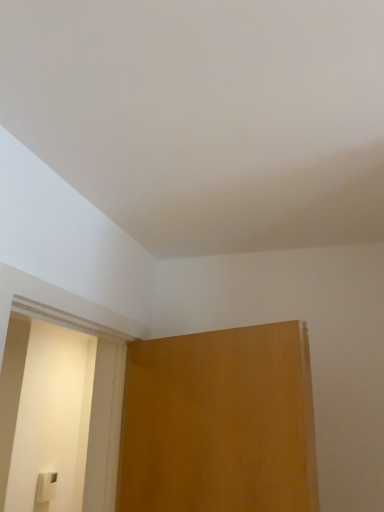
What is the approximate height of white plastic light switch at lower left?

white plastic light switch at lower left is 11.85 inches in height.

Describe the element at coordinates (46, 487) in the screenshot. I see `white plastic light switch at lower left` at that location.

In order to face white plastic light switch at lower left, should I rotate leftwards or rightwards?

Turn left by 19.217 degrees to look at white plastic light switch at lower left.

You are a GUI agent. You are given a task and a screenshot of the screen. Output one action in this format:
    pyautogui.click(x=<x>, y=<y>)
    Task: Click on the white plastic light switch at lower left
    Image resolution: width=384 pixels, height=512 pixels.
    Given the screenshot: What is the action you would take?
    pyautogui.click(x=46, y=487)

Describe the element at coordinates (43, 413) in the screenshot. I see `matte wood screen door at left` at that location.

At what (x,y) coordinates should I click in order to perform the action: click on matte wood screen door at left. Please return your answer as a coordinate pair (x, y). The width and height of the screenshot is (384, 512). Looking at the image, I should click on (43, 413).

Locate an element on the screen. The height and width of the screenshot is (512, 384). white plastic light switch at lower left is located at coordinates (46, 487).

Does white plastic light switch at lower left appear on the left side of matte wood screen door at left?

Indeed, white plastic light switch at lower left is positioned on the left side of matte wood screen door at left.

Which object is more forward, white plastic light switch at lower left or matte wood screen door at left?

matte wood screen door at left is closer to the camera.

Considering the points (54, 475) and (38, 449), which point is behind, point (54, 475) or point (38, 449)?

Point (54, 475)

From the image's perspective, is white plastic light switch at lower left above matte wood screen door at left?

No, from the image's perspective, white plastic light switch at lower left is not over matte wood screen door at left.

From a real-world perspective, between white plastic light switch at lower left and matte wood screen door at left, who is vertically higher?

From a 3D spatial view, matte wood screen door at left is above.

Which object is thinner, white plastic light switch at lower left or matte wood screen door at left?

white plastic light switch at lower left.

In terms of height, does white plastic light switch at lower left look taller or shorter compared to matte wood screen door at left?

white plastic light switch at lower left is shorter than matte wood screen door at left.

Who is smaller, white plastic light switch at lower left or matte wood screen door at left?

Smaller between the two is white plastic light switch at lower left.

Would you say white plastic light switch at lower left is outside matte wood screen door at left?

white plastic light switch at lower left lies outside matte wood screen door at left's area.

Are white plastic light switch at lower left and matte wood screen door at left far apart?

They are positioned close to each other.

Is white plastic light switch at lower left facing away from matte wood screen door at left?

That's not correct — white plastic light switch at lower left is not looking away from matte wood screen door at left.

How different are the orientations of white plastic light switch at lower left and matte wood screen door at left in degrees?

0.509 degrees.

At what (x,y) coordinates should I click in order to perform the action: click on light switch below the matte wood screen door at left (from a real-world perspective). Please return your answer as a coordinate pair (x, y). Looking at the image, I should click on (46, 487).

Can you confirm if matte wood screen door at left is positioned to the right of white plastic light switch at lower left?

Indeed, matte wood screen door at left is positioned on the right side of white plastic light switch at lower left.

Considering the positions of objects matte wood screen door at left and white plastic light switch at lower left in the image provided, who is in front, matte wood screen door at left or white plastic light switch at lower left?

matte wood screen door at left is more forward.

Does point (14, 336) come in front of point (53, 479)?

Yes, it is.

From the image's perspective, would you say matte wood screen door at left is positioned over white plastic light switch at lower left?

Yes, from the image's perspective, matte wood screen door at left is above white plastic light switch at lower left.

From a real-world perspective, between matte wood screen door at left and white plastic light switch at lower left, who is vertically higher?

In real-world perspective, matte wood screen door at left is above.

Does matte wood screen door at left have a greater width compared to white plastic light switch at lower left?

Yes, matte wood screen door at left is wider than white plastic light switch at lower left.

Does matte wood screen door at left have a greater height compared to white plastic light switch at lower left?

Indeed, matte wood screen door at left has a greater height compared to white plastic light switch at lower left.

Consider the image. Does matte wood screen door at left have a larger size compared to white plastic light switch at lower left?

Indeed, matte wood screen door at left has a larger size compared to white plastic light switch at lower left.

Would you say matte wood screen door at left contains white plastic light switch at lower left?

That's incorrect, white plastic light switch at lower left is not inside matte wood screen door at left.

Is matte wood screen door at left positioned far away from white plastic light switch at lower left?

No.

Is matte wood screen door at left turned away from white plastic light switch at lower left?

That's not correct — matte wood screen door at left is not looking away from white plastic light switch at lower left.

How many degrees apart are the facing directions of matte wood screen door at left and white plastic light switch at lower left?

matte wood screen door at left and white plastic light switch at lower left are facing 0.509 degrees away from each other.

How much distance is there between matte wood screen door at left and white plastic light switch at lower left?

matte wood screen door at left and white plastic light switch at lower left are 57.55 centimeters apart from each other.

This screenshot has height=512, width=384. I want to click on screen door above the white plastic light switch at lower left (from a real-world perspective), so click(x=43, y=413).

The image size is (384, 512). In order to click on screen door above the white plastic light switch at lower left (from the image's perspective) in this screenshot , I will do `click(43, 413)`.

Where is `light switch below the matte wood screen door at left (from a real-world perspective)`? The image size is (384, 512). light switch below the matte wood screen door at left (from a real-world perspective) is located at coordinates (46, 487).